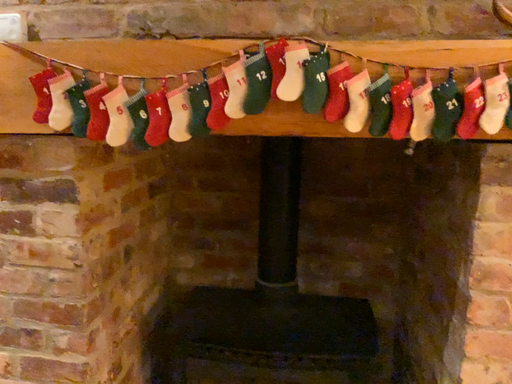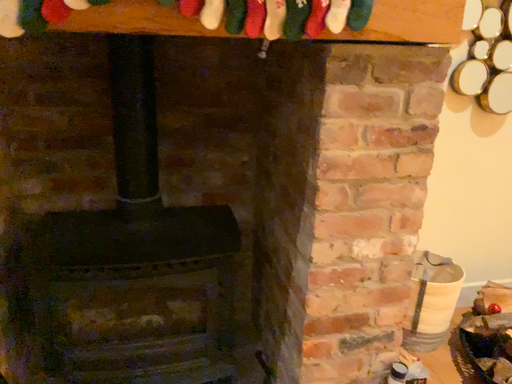
Question: How did the camera likely rotate when shooting the video?

Choices:
 (A) rotated left
 (B) rotated right

Answer: (B)